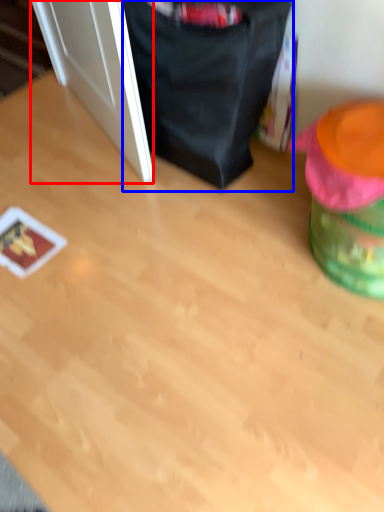
Question: Which point is closer to the camera, door (highlighted by a red box) or bean bag chair (highlighted by a blue box)?

Choices:
 (A) door
 (B) bean bag chair

Answer: (B)